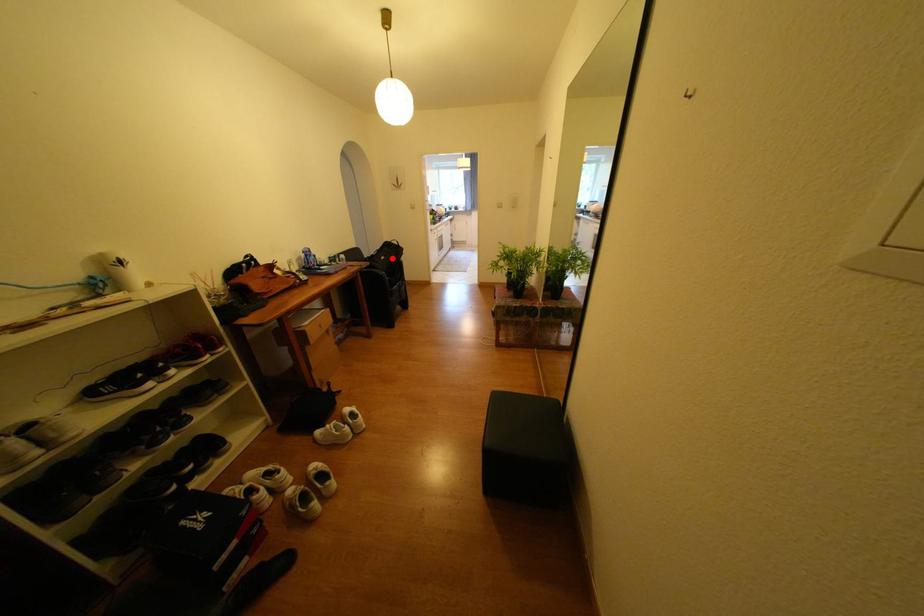
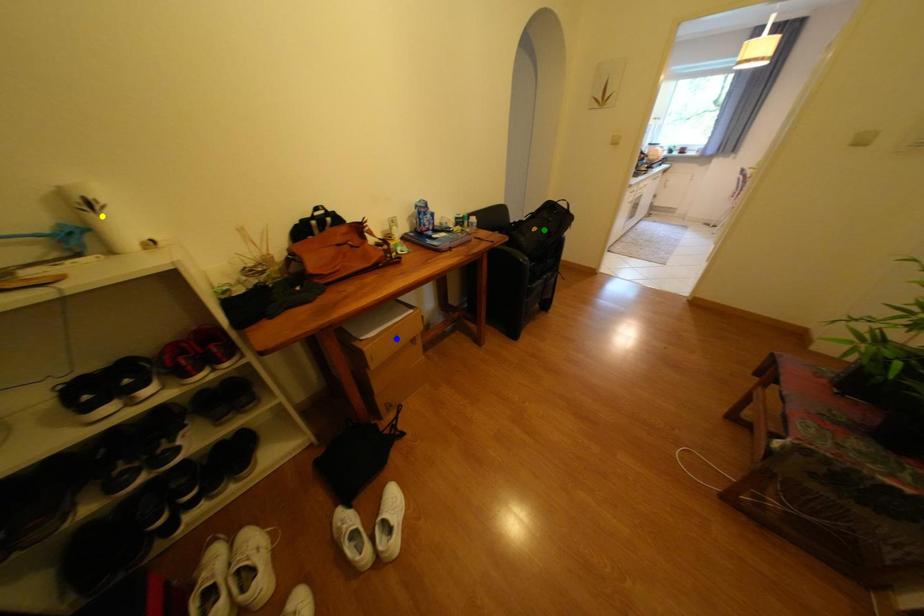
Question: I am providing you with two images of the same scene from different viewpoints. A red point is marked on the first image. You are given multiple points on the second image. Which spot in image 2 lines up with the point in image 1?

Choices:
 (A) green point
 (B) blue point
 (C) yellow point

Answer: (A)